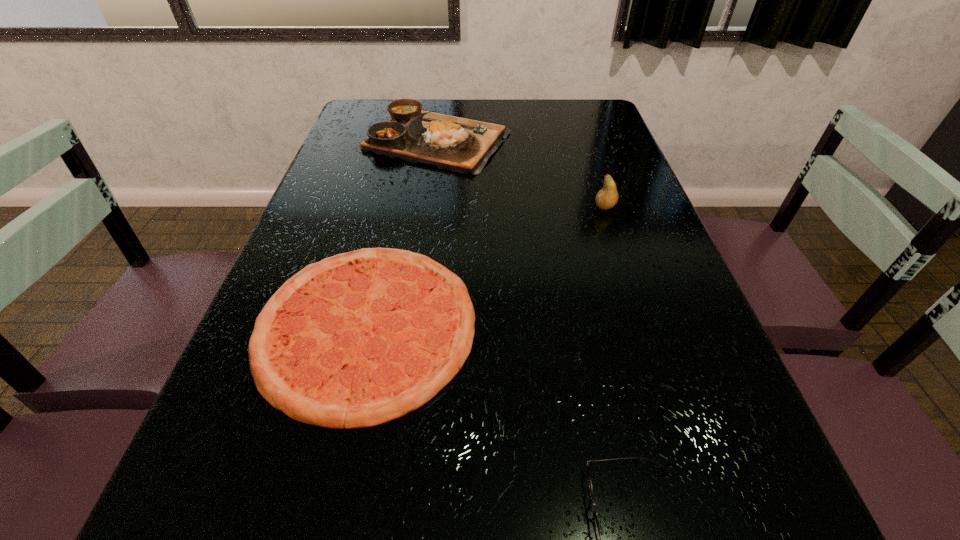
The width and height of the screenshot is (960, 540). In order to click on pizza that is at the left edge in this screenshot , I will do click(x=361, y=338).

Where is `object located in the right edge section of the desktop`? object located in the right edge section of the desktop is located at coordinates (607, 197).

In order to click on object located at the far left corner in this screenshot , I will do `click(461, 145)`.

In the image, there is a desktop. Where is `free space at the left edge`? This screenshot has height=540, width=960. free space at the left edge is located at coordinates (342, 138).

This screenshot has height=540, width=960. In the image, there is a desktop. In order to click on free space at the right edge in this screenshot , I will do `click(638, 228)`.

At what (x,y) coordinates should I click in order to perform the action: click on vacant position at the far left corner of the desktop. Please return your answer as a coordinate pair (x, y). The image size is (960, 540). Looking at the image, I should click on (361, 113).

Find the location of a particular element. vacant area at the far right corner of the desktop is located at coordinates (586, 108).

Locate an element on the screen. empty space between the pizza and the platter is located at coordinates (400, 233).

Identify the location of empty space that is in between the platter and the third farthest object. (400, 233).

You are a GUI agent. You are given a task and a screenshot of the screen. Output one action in this format:
    pyautogui.click(x=<x>, y=<y>)
    Task: Click on the unoccupied position between the platter and the third nearest object
    
    Given the screenshot: What is the action you would take?
    pyautogui.click(x=519, y=173)